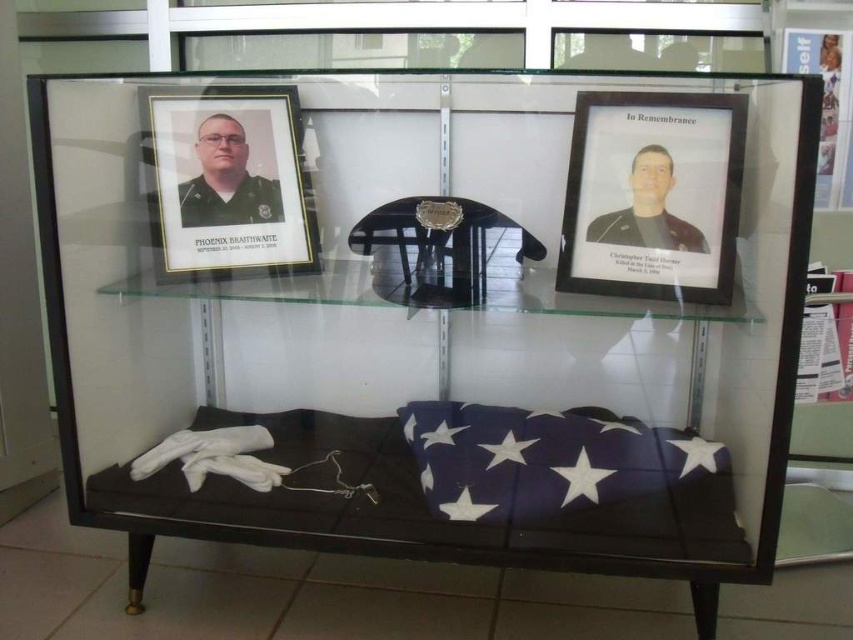
Consider the image. Is blue fabric flag at lower center smaller than matte black uniform at left?

No, blue fabric flag at lower center is not smaller than matte black uniform at left.

Who is shorter, blue fabric flag at lower center or matte black uniform at left?

With less height is blue fabric flag at lower center.

Is point (660, 476) positioned before point (206, 141)?

Yes, point (660, 476) is in front of point (206, 141).

Identify the location of blue fabric flag at lower center. This screenshot has width=853, height=640. (549, 460).

Does matte glass photo frame at upper left have a lesser height compared to dark brown leather jacket at upper right?

No.

Who is more forward, (198, 252) or (630, 227)?

Positioned in front is point (630, 227).

Between point (238, 232) and point (648, 157), which one is positioned behind?

The point (238, 232) is more distant.

Where is `matte glass photo frame at upper left`? The height and width of the screenshot is (640, 853). matte glass photo frame at upper left is located at coordinates (231, 182).

Identify the location of black matte picture frame at upper right. pyautogui.click(x=653, y=195).

Between point (590, 166) and point (268, 192), which one is positioned in front?

Point (590, 166) is more forward.

At what (x,y) coordinates should I click in order to perform the action: click on black matte picture frame at upper right. Please return your answer as a coordinate pair (x, y). Looking at the image, I should click on (653, 195).